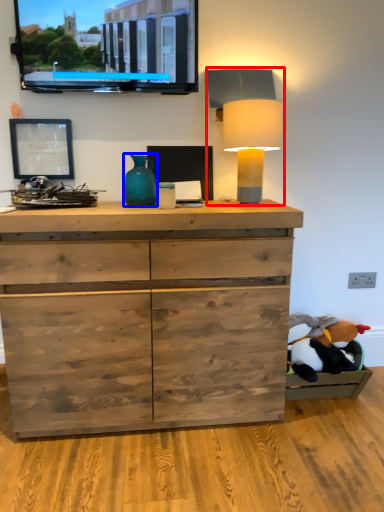
Question: Which point is closer to the camera, table lamp (highlighted by a red box) or vase (highlighted by a blue box)?

Choices:
 (A) table lamp
 (B) vase

Answer: (A)